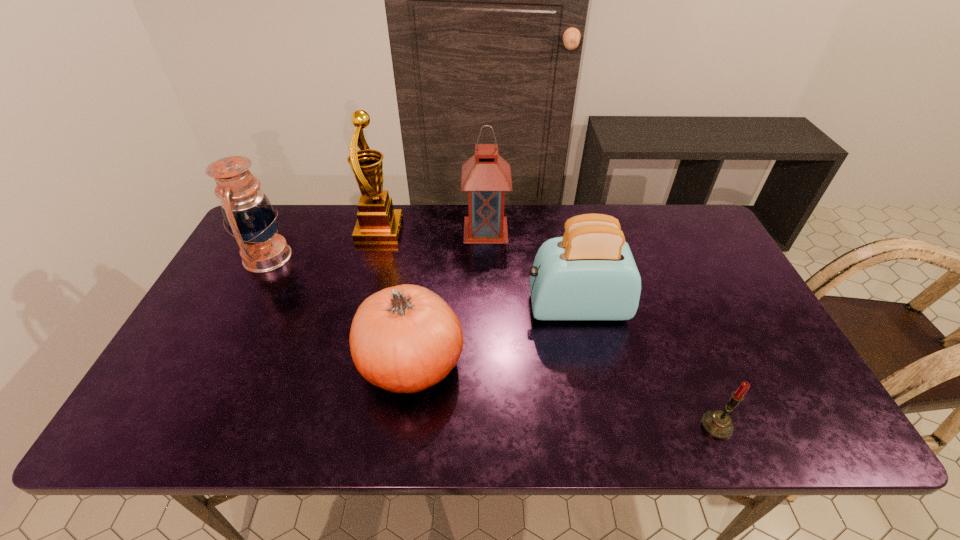
You are a GUI agent. You are given a task and a screenshot of the screen. Output one action in this format:
    pyautogui.click(x=<x>, y=<y>)
    Task: Click on the object located at the left edge
    This screenshot has width=960, height=540.
    Given the screenshot: What is the action you would take?
    pyautogui.click(x=248, y=213)

At what (x,y) coordinates should I click in order to perform the action: click on object that is at the far left corner. Please return your answer as a coordinate pair (x, y). Looking at the image, I should click on (248, 213).

What are the coordinates of `vacant area at the far edge` in the screenshot? It's located at (545, 219).

Locate an element on the screen. This screenshot has height=540, width=960. vacant space at the near edge is located at coordinates point(382,435).

This screenshot has width=960, height=540. Find the location of `vacant space at the left edge of the desktop`. vacant space at the left edge of the desktop is located at coordinates (253, 295).

Locate an element on the screen. free space at the right edge is located at coordinates (691, 262).

I want to click on vacant point at the far right corner, so click(668, 222).

Locate an element on the screen. The image size is (960, 540). vacant space at the near right corner is located at coordinates (x=761, y=436).

In order to click on free space between the leftmost object and the fifth tallest object in this screenshot , I will do (340, 309).

The image size is (960, 540). I want to click on vacant space that is in between the nearest object and the fifth object from left to right, so click(x=646, y=366).